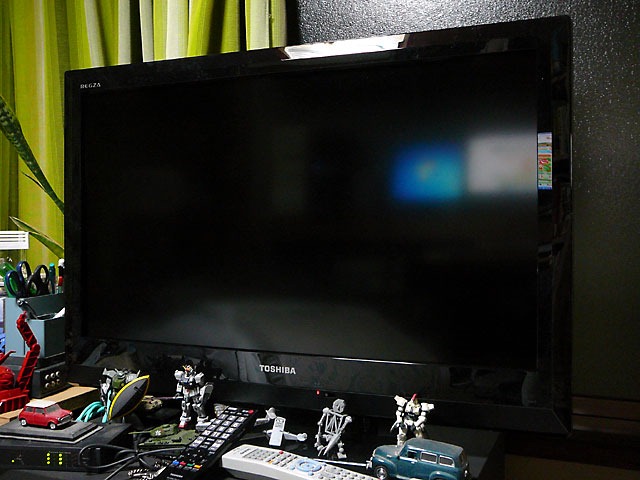
Where is `plant`? Image resolution: width=640 pixels, height=480 pixels. plant is located at coordinates (10, 128), (33, 163).